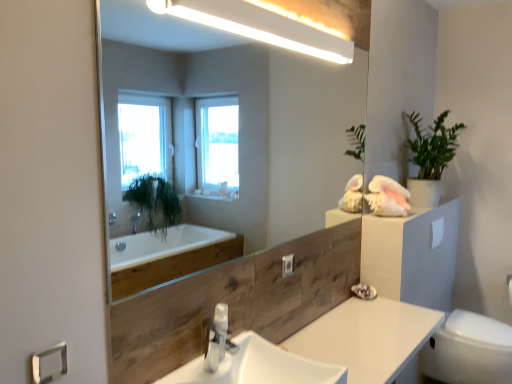
Image resolution: width=512 pixels, height=384 pixels. I want to click on satin nickel faucet at center, so coord(217,338).

Measure the distance between satin nickel faucet at center and camera.

satin nickel faucet at center is 4.36 feet from camera.

What is the approximate width of green matte plant at upper right?

It is 13.17 inches.

The width and height of the screenshot is (512, 384). What are the coordinates of `white glossy sink at center` in the screenshot? It's located at (250, 361).

What is the approximate width of white glossy countertop at center?

white glossy countertop at center is 17.94 inches wide.

Find the location of a particular element. The image size is (512, 384). white glossy light fixture at upper center is located at coordinates (258, 26).

Describe the element at coordinates (258, 26) in the screenshot. I see `white glossy light fixture at upper center` at that location.

What is the approximate height of transparent glass mirror at upper center?

The height of transparent glass mirror at upper center is 34.87 inches.

The height and width of the screenshot is (384, 512). In order to click on satin nickel faucet at center in this screenshot , I will do `click(217, 338)`.

From the image's perspective, which is above, white glossy toilet bowl at lower right or silver metallic towel bar at lower left?

From the image's view, silver metallic towel bar at lower left is above.

Considering the sizes of objects white glossy toilet bowl at lower right and silver metallic towel bar at lower left in the image provided, who is wider, white glossy toilet bowl at lower right or silver metallic towel bar at lower left?

white glossy toilet bowl at lower right.

Is white glossy toilet bowl at lower right touching silver metallic towel bar at lower left?

They are not placed beside each other.

Based on the photo, from the image's perspective, would you say silver metallic towel bar at lower left is positioned over green matte plant at upper right?

No.

Can you confirm if silver metallic towel bar at lower left is bigger than green matte plant at upper right?

No.

Is silver metallic towel bar at lower left aimed at green matte plant at upper right?

No, silver metallic towel bar at lower left is not oriented towards green matte plant at upper right.

Which of these two, silver metallic towel bar at lower left or green matte plant at upper right, stands taller?

green matte plant at upper right.

Considering the sizes of objects white glossy sink at center and green matte plant at upper right in the image provided, who is smaller, white glossy sink at center or green matte plant at upper right?

white glossy sink at center.

Is white glossy sink at center facing away from green matte plant at upper right?

white glossy sink at center does not have its back to green matte plant at upper right.

Is white glossy sink at center touching green matte plant at upper right?

No, white glossy sink at center is not beside green matte plant at upper right.

Which object is thinner, white glossy sink at center or green matte plant at upper right?

Thinner between the two is green matte plant at upper right.

Which of these two, white glossy light fixture at upper center or transparent glass mirror at upper center, is thinner?

transparent glass mirror at upper center is thinner.

Is white glossy light fixture at upper center not close to transparent glass mirror at upper center?

Absolutely, white glossy light fixture at upper center is distant from transparent glass mirror at upper center.

Based on their positions, is white glossy light fixture at upper center located to the left or right of transparent glass mirror at upper center?

In the image, white glossy light fixture at upper center appears on the right side of transparent glass mirror at upper center.

Which of these two, white glossy countertop at center or silver metallic towel bar at lower left, is bigger?

white glossy countertop at center.

Is point (330, 343) positioned after point (44, 369)?

Yes, it is behind point (44, 369).

At what (x,y) coordinates should I click in order to perform the action: click on counter top below the silver metallic towel bar at lower left (from the image's perspective). Please return your answer as a coordinate pair (x, y). Looking at the image, I should click on (367, 337).

From the picture: Can you confirm if white matte toilet paper at right is thinner than green matte plant at upper right?

Correct, the width of white matte toilet paper at right is less than that of green matte plant at upper right.

Which object is further away from the camera taking this photo, white matte toilet paper at right or green matte plant at upper right?

white matte toilet paper at right is behind.

From the image's perspective, would you say white matte toilet paper at right is positioned over green matte plant at upper right?

Incorrect, from the image's perspective, white matte toilet paper at right is lower than green matte plant at upper right.

Which is correct: white matte toilet paper at right is inside green matte plant at upper right, or outside of it?

white matte toilet paper at right lies outside green matte plant at upper right.

Looking at this image, who is smaller, silver metallic towel bar at lower left or white glossy sink at center?

With smaller size is silver metallic towel bar at lower left.

Is point (38, 355) farther from camera compared to point (240, 336)?

No, (38, 355) is closer to viewer.

Between silver metallic towel bar at lower left and white glossy sink at center, which one has larger width?

With larger width is white glossy sink at center.

How many degrees apart are the facing directions of silver metallic towel bar at lower left and white glossy sink at center?

The angular difference between silver metallic towel bar at lower left and white glossy sink at center is 0.525 degrees.

What are the coordinates of `towel bar in front of the white glossy toilet bowl at lower right` in the screenshot? It's located at [x=49, y=364].

This screenshot has height=384, width=512. I want to click on plant behind the silver metallic towel bar at lower left, so click(432, 145).

Based on their spatial positions, is green matte plant at upper right or white glossy sink at center closer to white glossy toilet bowl at lower right?

Based on the image, green matte plant at upper right appears to be nearer to white glossy toilet bowl at lower right.

Which object lies nearer to the anchor point white glossy toilet bowl at lower right, white glossy countertop at center or transparent glass mirror at upper center?

white glossy countertop at center.

Looking at the image, which one is located closer to white glossy countertop at center, white glossy toilet bowl at lower right or white glossy light fixture at upper center?

white glossy toilet bowl at lower right is positioned closer to the anchor white glossy countertop at center.

From the image, which object appears to be nearer to white glossy countertop at center, green matte plant at upper right or white glossy sink at center?

Among the two, white glossy sink at center is located nearer to white glossy countertop at center.

From the image, which object appears to be nearer to white matte toilet paper at right, white glossy toilet bowl at lower right or green matte plant at upper right?

green matte plant at upper right.

Looking at the image, which one is located further to white glossy toilet bowl at lower right, white matte toilet paper at right or white glossy sink at center?

white glossy sink at center is further to white glossy toilet bowl at lower right.

When comparing their distances from satin nickel faucet at center, does white glossy toilet bowl at lower right or green matte plant at upper right seem closer?

The object closer to satin nickel faucet at center is white glossy toilet bowl at lower right.

When comparing their distances from green matte plant at upper right, does white glossy countertop at center or silver metallic towel bar at lower left seem closer?

Among the two, white glossy countertop at center is located nearer to green matte plant at upper right.

Locate an element on the screen. The width and height of the screenshot is (512, 384). sink that lies between transparent glass mirror at upper center and white glossy countertop at center from top to bottom is located at coordinates [250, 361].

The height and width of the screenshot is (384, 512). In order to click on tap located between transparent glass mirror at upper center and green matte plant at upper right in the depth direction in this screenshot , I will do `click(217, 338)`.

Where is `counter top between silver metallic towel bar at lower left and white glossy toilet bowl at lower right in the horizontal direction`? counter top between silver metallic towel bar at lower left and white glossy toilet bowl at lower right in the horizontal direction is located at coordinates (367, 337).

Where is `counter top situated between satin nickel faucet at center and white glossy toilet bowl at lower right from left to right`? counter top situated between satin nickel faucet at center and white glossy toilet bowl at lower right from left to right is located at coordinates (367, 337).